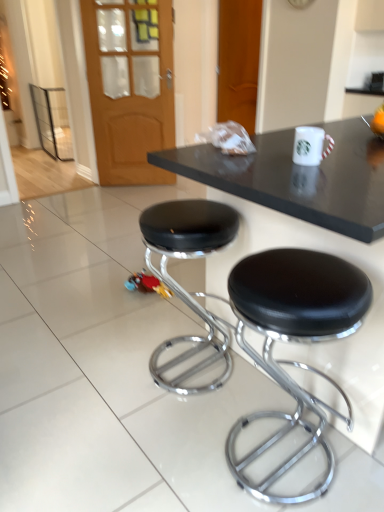
Question: Can you confirm if black leather stool at lower right, positioned as the second stool in left-to-right order, is wider than wooden door at upper left?

Choices:
 (A) yes
 (B) no

Answer: (A)

Question: Is black leather stool at lower right, positioned as the second stool in left-to-right order, bigger than wooden door at upper left?

Choices:
 (A) no
 (B) yes

Answer: (B)

Question: Is black leather stool at lower right, positioned as the second stool in left-to-right order, taller than wooden door at upper left?

Choices:
 (A) no
 (B) yes

Answer: (A)

Question: Is black leather stool at lower right, positioned as the second stool in left-to-right order, turned away from wooden door at upper left?

Choices:
 (A) yes
 (B) no

Answer: (B)

Question: From a real-world perspective, is black leather stool at lower right, the first stool from the right, on wooden door at upper left?

Choices:
 (A) no
 (B) yes

Answer: (A)

Question: Is black leather stool at lower right, the first stool from the right, next to wooden door at upper left?

Choices:
 (A) no
 (B) yes

Answer: (A)

Question: From a real-world perspective, is black leather stool at center, which ranks as the 1th stool in left-to-right order, physically below black leather stool at lower right, the first stool from the right?

Choices:
 (A) no
 (B) yes

Answer: (B)

Question: Does black leather stool at center, the second stool from the right, turn towards black leather stool at lower right, the first stool from the right?

Choices:
 (A) yes
 (B) no

Answer: (B)

Question: Is the depth of black leather stool at center, which ranks as the 1th stool in left-to-right order, greater than that of black leather stool at lower right, the first stool from the right?

Choices:
 (A) no
 (B) yes

Answer: (B)

Question: Is black leather stool at center, the second stool from the right, wider than black leather stool at lower right, positioned as the second stool in left-to-right order?

Choices:
 (A) yes
 (B) no

Answer: (B)

Question: Is black leather stool at center, the second stool from the right, bigger than black leather stool at lower right, the first stool from the right?

Choices:
 (A) yes
 (B) no

Answer: (A)

Question: Are black leather stool at center, which ranks as the 1th stool in left-to-right order, and black leather stool at lower right, the first stool from the right, located far from each other?

Choices:
 (A) no
 (B) yes

Answer: (A)

Question: Can you confirm if black leather stool at lower right, the first stool from the right, is bigger than black leather stool at center, which ranks as the 1th stool in left-to-right order?

Choices:
 (A) yes
 (B) no

Answer: (B)